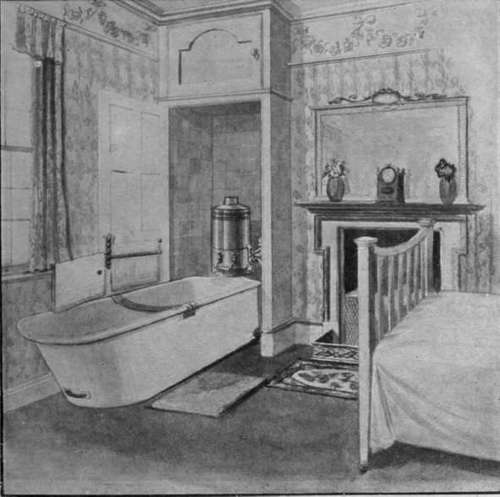
In order to click on shelf in this screenshot , I will do `click(206, 66)`.